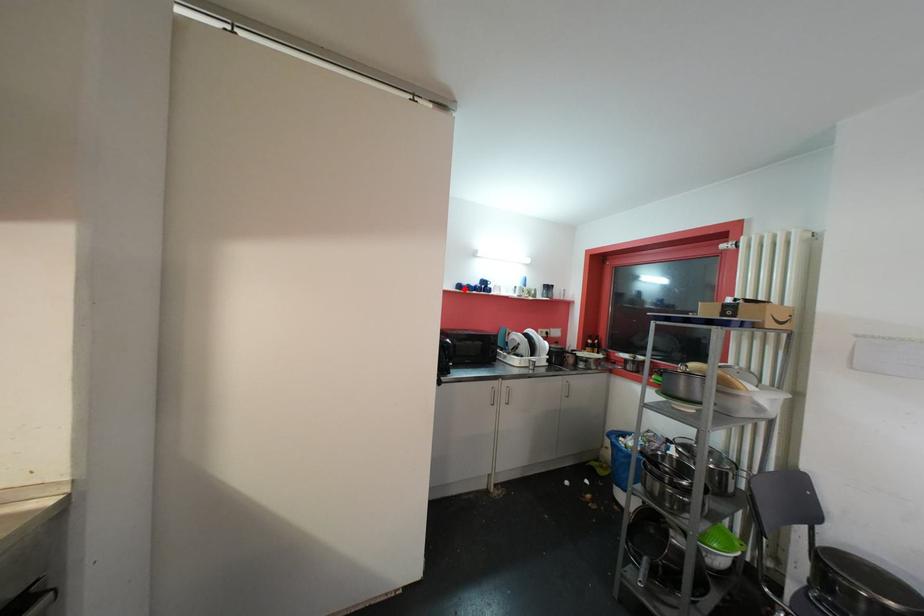
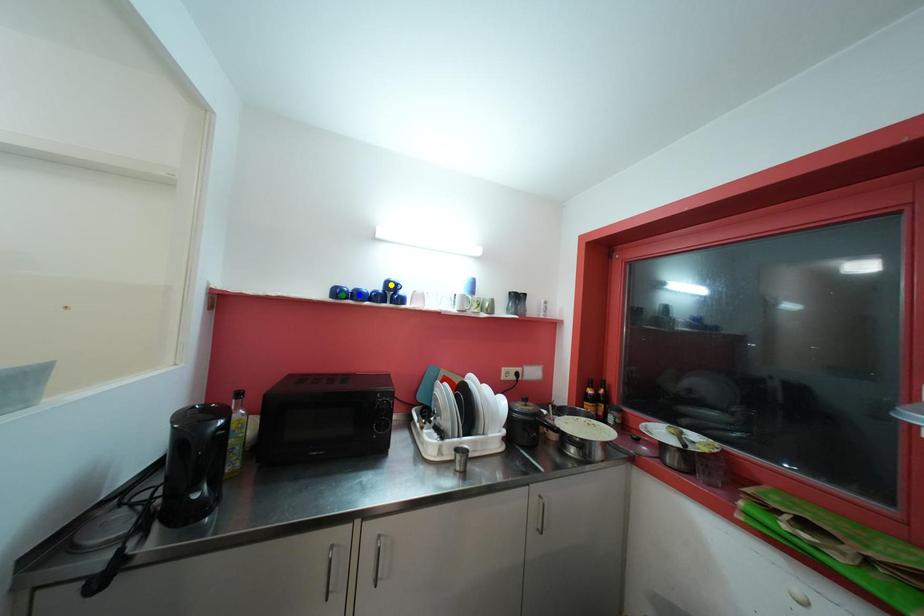
Question: I am providing you with two images of the same scene from different viewpoints. A red point is marked on the first image. You are given multiple points on the second image. Can you choose the point in image 2 that corresponds to the point in image 1?

Choices:
 (A) blue point
 (B) yellow point
 (C) green point

Answer: (C)